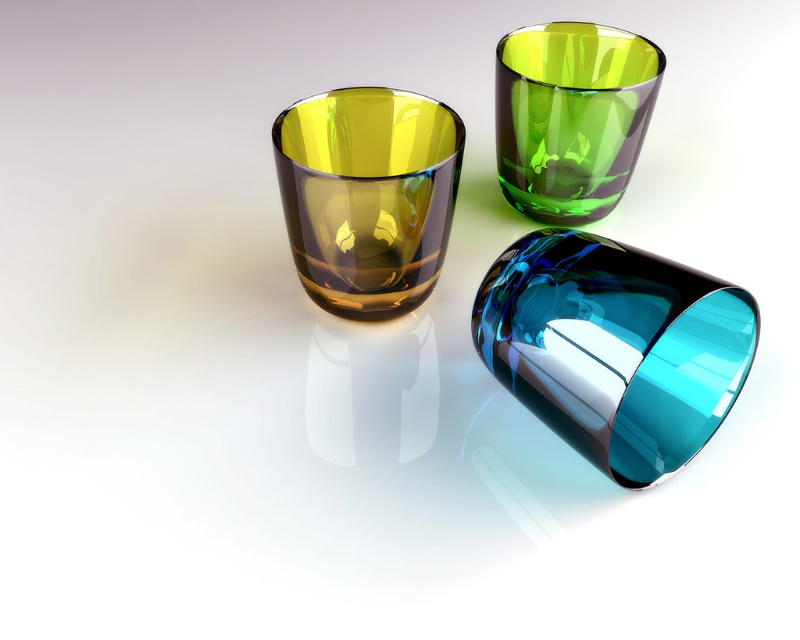
Question: Among these points, which one is farthest from the camera?

Choices:
 (A) (541, 362)
 (B) (550, 28)

Answer: (B)

Question: Which point is farther to the camera?

Choices:
 (A) green translucent glass at upper center
 (B) amber glass at center

Answer: (A)

Question: Among these objects, which one is nearest to the camera?

Choices:
 (A) amber glass at center
 (B) translucent blue glass at lower right

Answer: (B)

Question: Is translucent blue glass at lower right smaller than green translucent glass at upper center?

Choices:
 (A) no
 (B) yes

Answer: (A)

Question: Is the position of translucent blue glass at lower right more distant than that of amber glass at center?

Choices:
 (A) no
 (B) yes

Answer: (A)

Question: Does translucent blue glass at lower right have a lesser width compared to green translucent glass at upper center?

Choices:
 (A) no
 (B) yes

Answer: (A)